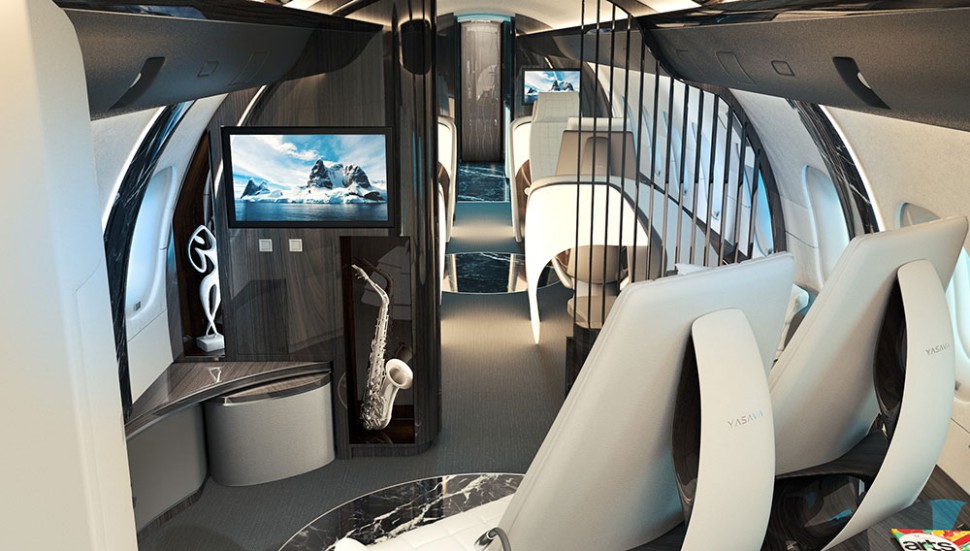
Find the location of a particular element. windows is located at coordinates (831, 217), (162, 220).